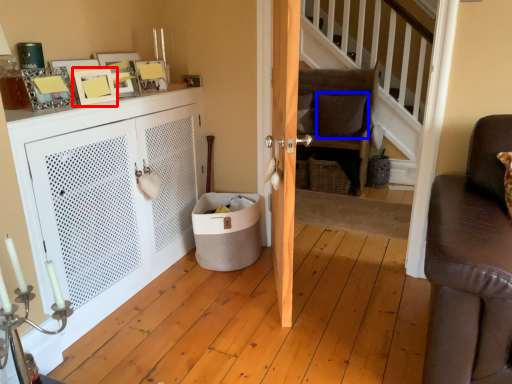
Question: Among these objects, which one is farthest to the camera, picture frame (highlighted by a red box) or pillow (highlighted by a blue box)?

Choices:
 (A) picture frame
 (B) pillow

Answer: (B)